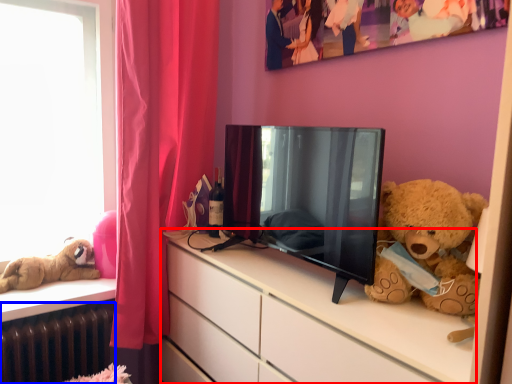
Question: Which point is further to the camera, cabinetry (highlighted by a red box) or radiator (highlighted by a blue box)?

Choices:
 (A) cabinetry
 (B) radiator

Answer: (B)